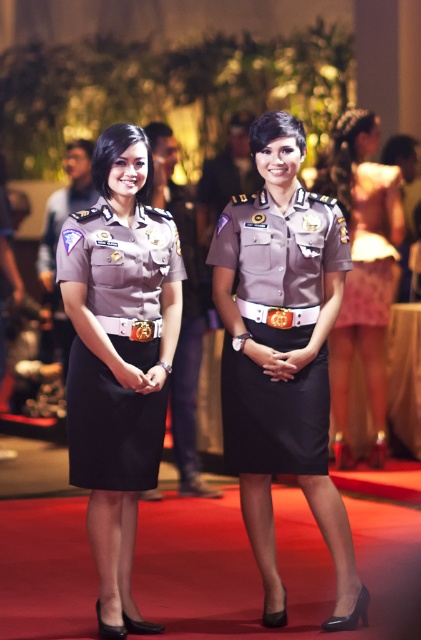
Does matte gray uniform at center have a greater height compared to matte black dress at center?

Correct, matte gray uniform at center is much taller as matte black dress at center.

Identify the location of matte gray uniform at center. (282, 355).

Which is behind, point (181, 280) or point (333, 179)?

Point (333, 179)

Find the location of a particular element. matte black dress at center is located at coordinates (122, 273).

Who is more distant from viewer, (156, 419) or (341, 376)?

Positioned behind is point (341, 376).

I want to click on matte black dress at center, so tap(122, 273).

In order to click on matte gray uniform at center in this screenshot , I will do `click(282, 355)`.

Who is lower down, matte gray uniform at center or silky pink dress at right?

matte gray uniform at center

Measure the distance between matte gray uniform at center and camera.

The distance of matte gray uniform at center from camera is 4.58 meters.

Find the location of a particular element. This screenshot has width=421, height=640. matte gray uniform at center is located at coordinates (282, 355).